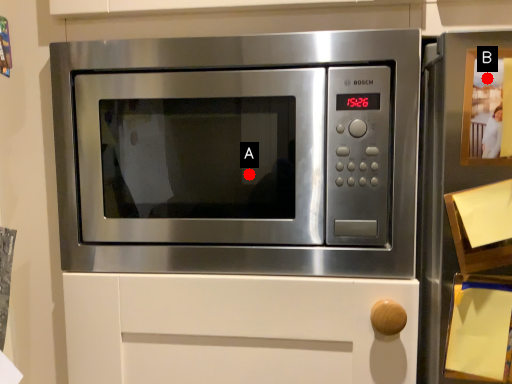
Question: Two points are circled on the image, labeled by A and B beside each circle. Which point is closer to the camera?

Choices:
 (A) A is closer
 (B) B is closer

Answer: (B)